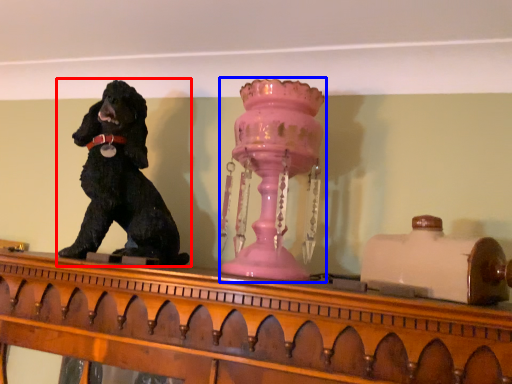
Question: Which of the following is the farthest to the observer, dog (highlighted by a red box) or candle holder (highlighted by a blue box)?

Choices:
 (A) dog
 (B) candle holder

Answer: (A)